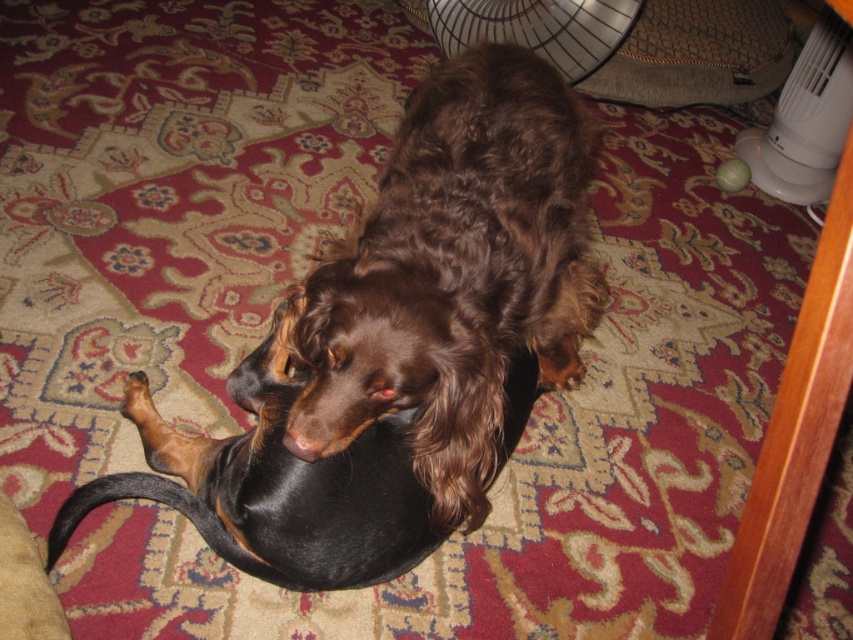
Question: Which point is farther to the camera?

Choices:
 (A) (473, 3)
 (B) (799, 97)

Answer: (A)

Question: Does brown furry dog at center have a smaller size compared to metallic silver fan at upper center?

Choices:
 (A) yes
 (B) no

Answer: (B)

Question: Which object is closer to the camera taking this photo?

Choices:
 (A) brown furry dog at center
 (B) white plastic fan at upper right

Answer: (A)

Question: Is the position of brown furry dog at center less distant than that of metallic silver fan at upper center?

Choices:
 (A) no
 (B) yes

Answer: (B)

Question: Is brown furry dog at center closer to camera compared to metallic silver fan at upper center?

Choices:
 (A) yes
 (B) no

Answer: (A)

Question: Which point is closer to the camera?

Choices:
 (A) brown furry dog at center
 (B) metallic silver fan at upper center

Answer: (A)